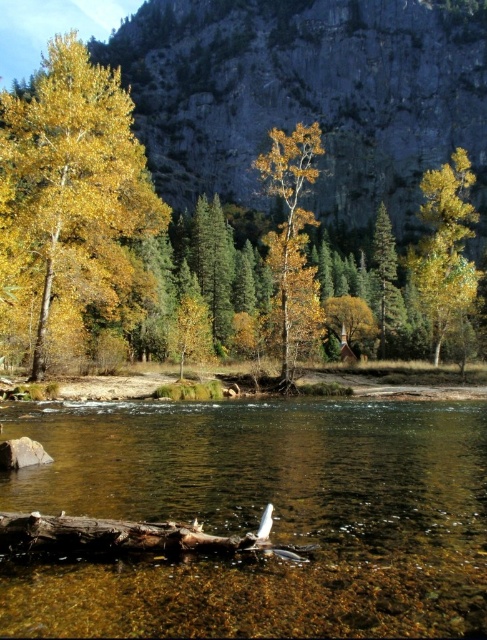
Question: Which of the following is the closest to the observer?

Choices:
 (A) yellow matte tree at right
 (B) golden yellow leaves at center
 (C) golden yellow leaves at left

Answer: (C)

Question: Can you confirm if clear water at center is smaller than green matte tree at center?

Choices:
 (A) yes
 (B) no

Answer: (A)

Question: Does yellow matte tree at right have a lesser width compared to green matte tree at center?

Choices:
 (A) no
 (B) yes

Answer: (A)

Question: Does brown rough log at lower center have a greater width compared to green matte tree at center?

Choices:
 (A) no
 (B) yes

Answer: (A)

Question: Which of the following is the closest to the observer?

Choices:
 (A) (35, 529)
 (B) (297, 323)

Answer: (A)

Question: Which of the following is the farthest from the observer?

Choices:
 (A) (381, 307)
 (B) (168, 609)

Answer: (A)